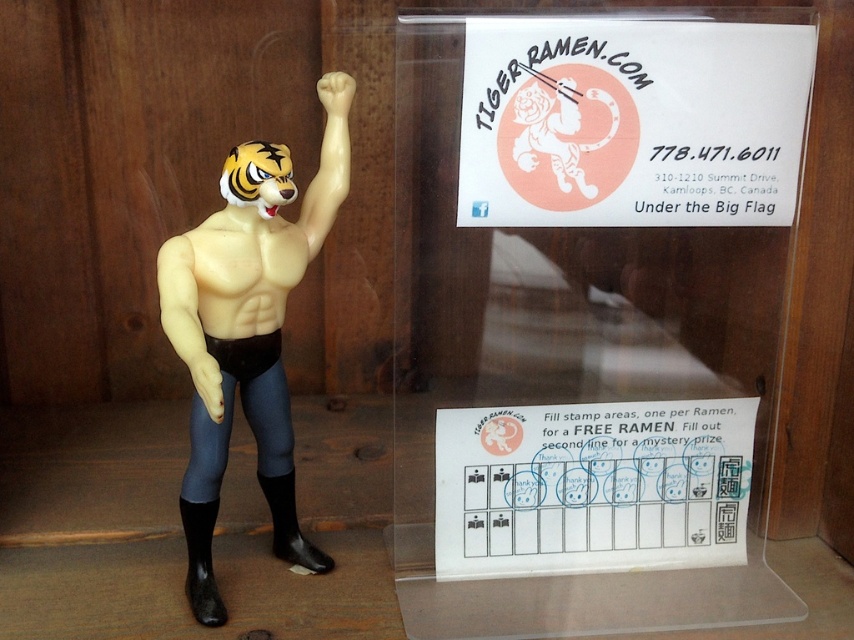
Which of these two, matte plastic tiger figure at center or smooth beige muscle at center, stands shorter?

Standing shorter between the two is smooth beige muscle at center.

Which is below, matte plastic tiger figure at center or smooth beige muscle at center?

matte plastic tiger figure at center

Is point (300, 536) farther from viewer compared to point (247, 269)?

Yes, point (300, 536) is behind point (247, 269).

The image size is (854, 640). What are the coordinates of `matte plastic tiger figure at center` in the screenshot? It's located at (247, 330).

From the picture: Can you confirm if matte plastic tiger figure at center is smaller than white matte tiger head at upper center?

Actually, matte plastic tiger figure at center might be larger than white matte tiger head at upper center.

Which is behind, point (235, 268) or point (570, 144)?

The point (570, 144) is behind.

Image resolution: width=854 pixels, height=640 pixels. In order to click on matte plastic tiger figure at center in this screenshot , I will do `click(247, 330)`.

Is point (623, 108) positioned before point (232, 276)?

No.

Measure the distance between white paper sign at upper center and camera.

white paper sign at upper center is 38.45 inches away from camera.

Which is behind, point (553, 204) or point (249, 330)?

Point (249, 330)

Image resolution: width=854 pixels, height=640 pixels. In order to click on white paper sign at upper center in this screenshot , I will do `click(630, 122)`.